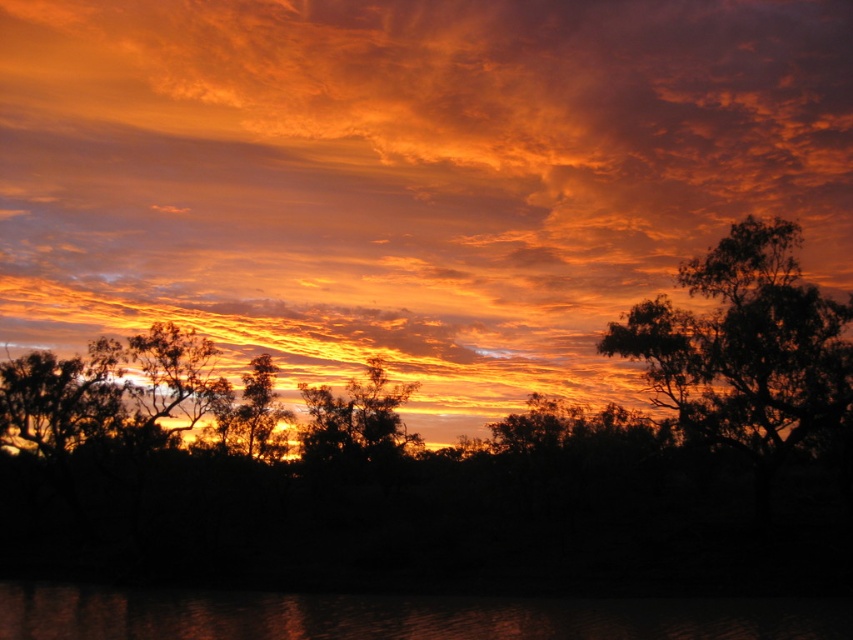
You are an artist trying to paint the sunset scene. You need to decide which area to paint first based on their widths. According to the scene, which object has a greater width, the glossy reflective water at lower center or the silhouette tree at center?

The glossy reflective water at lower center has a greater width than the silhouette tree at center.

You are an artist trying to paint the sunset scene. You want to ensure the orange matte cloud at upper center and the silhouette tree at center are positioned correctly. Based on the scene, which object should appear closer to the viewer?

The orange matte cloud at upper center is in front of the silhouette tree at center, so it should appear closer to the viewer.